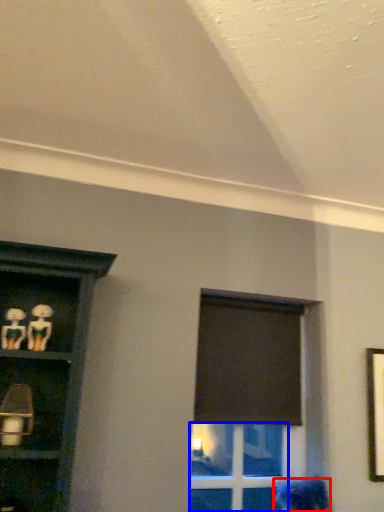
Question: Which point is closer to the camera, woman (highlighted by a red box) or glass door (highlighted by a blue box)?

Choices:
 (A) woman
 (B) glass door

Answer: (A)